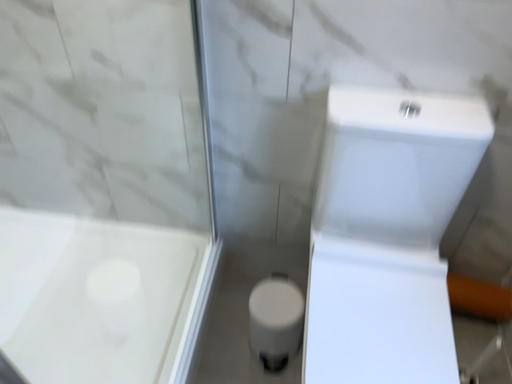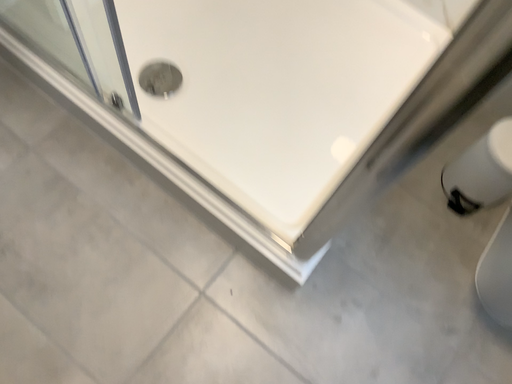
Question: How did the camera likely rotate when shooting the video?

Choices:
 (A) rotated right
 (B) rotated left

Answer: (B)